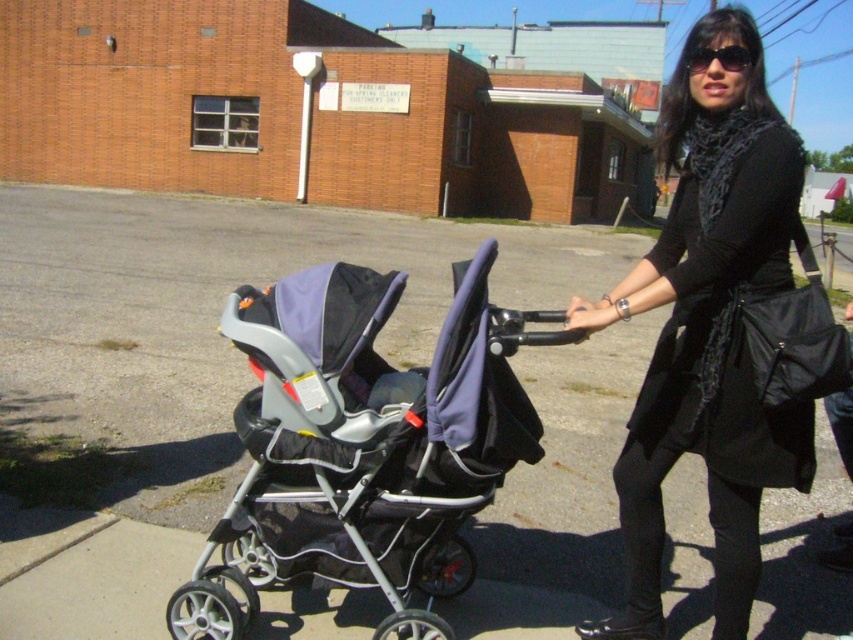
Who is positioned more to the right, gray asphalt pavement at center or silver metallic stroller at center?

Positioned to the right is silver metallic stroller at center.

Is point (85, 308) closer to camera compared to point (329, 580)?

No.

I want to click on gray asphalt pavement at center, so click(x=213, y=317).

Who is more distant from viewer, (x=500, y=288) or (x=734, y=554)?

Positioned behind is point (x=500, y=288).

Does gray asphalt pavement at center have a greater height compared to black matte coat at center?

In fact, gray asphalt pavement at center may be shorter than black matte coat at center.

Describe the element at coordinates (213, 317) in the screenshot. I see `gray asphalt pavement at center` at that location.

Locate an element on the screen. The height and width of the screenshot is (640, 853). gray asphalt pavement at center is located at coordinates (213, 317).

Can you confirm if black matte coat at center is smaller than sunglasses at upper center?

No.

Can you confirm if black matte coat at center is taller than sunglasses at upper center?

Indeed, black matte coat at center has a greater height compared to sunglasses at upper center.

Which is behind, point (779, 246) or point (746, 51)?

Point (746, 51)

I want to click on black matte coat at center, so click(708, 332).